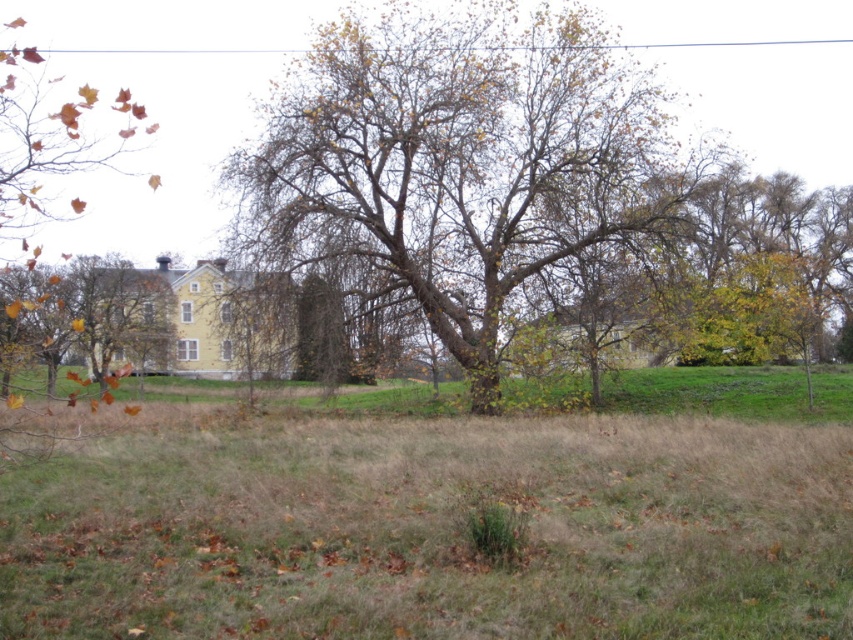
Question: Among these objects, which one is nearest to the camera?

Choices:
 (A) brown grass at center
 (B) brown rough bark tree at center

Answer: (A)

Question: Does brown grass at center lie behind brown rough bark tree at center?

Choices:
 (A) yes
 (B) no

Answer: (B)

Question: Is brown grass at center closer to camera compared to brown rough bark tree at center?

Choices:
 (A) no
 (B) yes

Answer: (B)

Question: Does brown grass at center have a larger size compared to brown rough bark tree at center?

Choices:
 (A) no
 (B) yes

Answer: (A)